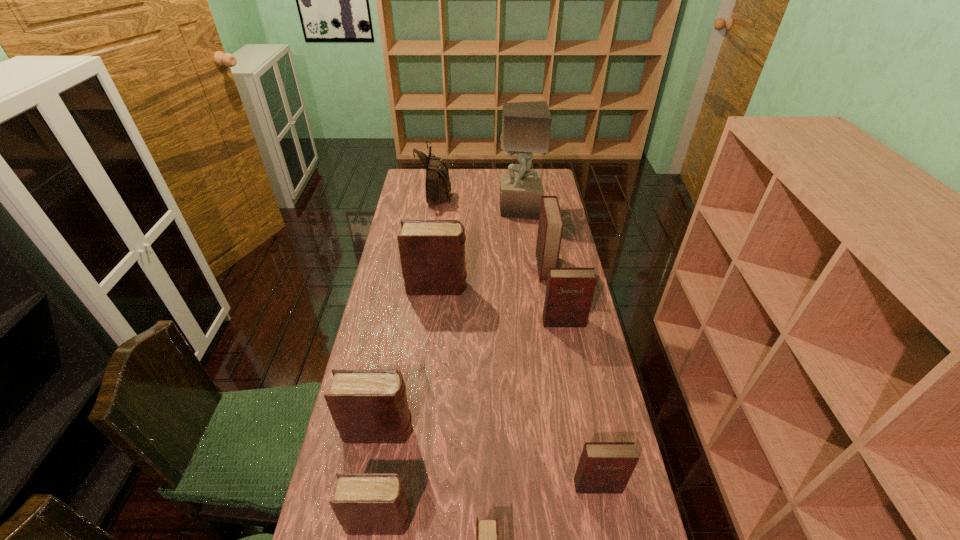
You are a GUI agent. You are given a task and a screenshot of the screen. Output one action in this format:
    pyautogui.click(x=<x>, y=<y>)
    Task: Click on the vacant space at the right edge of the desktop
    Image resolution: width=960 pixels, height=540 pixels.
    Given the screenshot: What is the action you would take?
    pyautogui.click(x=585, y=428)

I want to click on empty location between the third biggest brown diary and the gray sculpture, so click(x=449, y=364).

Locate an element on the screen. This screenshot has height=540, width=960. free point between the third nearest object and the shoulder bag is located at coordinates (516, 340).

Where is `free space between the biggest reddish-brown diary and the biggest brown diary`? This screenshot has width=960, height=540. free space between the biggest reddish-brown diary and the biggest brown diary is located at coordinates (491, 277).

Locate an element on the screen. This screenshot has height=540, width=960. free point between the third nearest brown diary and the tallest object is located at coordinates (449, 320).

The height and width of the screenshot is (540, 960). Find the location of `vacant space in between the farthest brown diary and the tallest object`. vacant space in between the farthest brown diary and the tallest object is located at coordinates (478, 248).

Where is `unoccupied position between the shoulder bag and the sculpture`? Image resolution: width=960 pixels, height=540 pixels. unoccupied position between the shoulder bag and the sculpture is located at coordinates (477, 201).

The image size is (960, 540). Identify the location of vacant space that is in between the farthest reddish-brown diary and the nearest reddish-brown diary. 571,376.

Where is `object that is the third closest one to the rightmost brown diary`? The height and width of the screenshot is (540, 960). object that is the third closest one to the rightmost brown diary is located at coordinates (367, 406).

Find the location of a particular element. object identified as the closest to the second smallest reddish-brown diary is located at coordinates (550, 228).